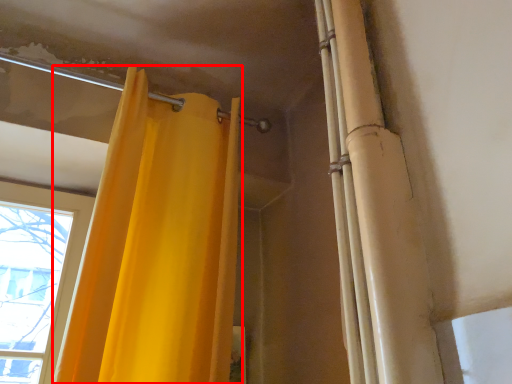
Question: Observing the image, what is the correct spatial positioning of curtain (annotated by the red box) in reference to shower curtain?

Choices:
 (A) right
 (B) left

Answer: (B)